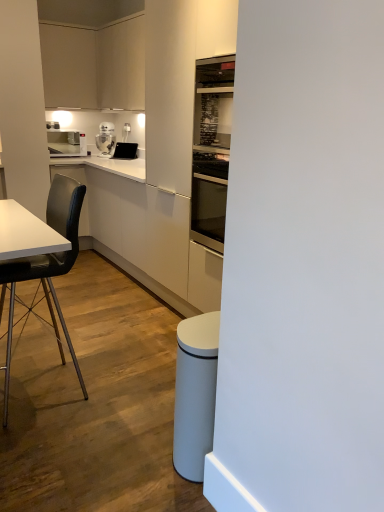
Locate an element on the screen. This screenshot has height=512, width=384. vacant area on the back side of black matte chair at left is located at coordinates (81, 344).